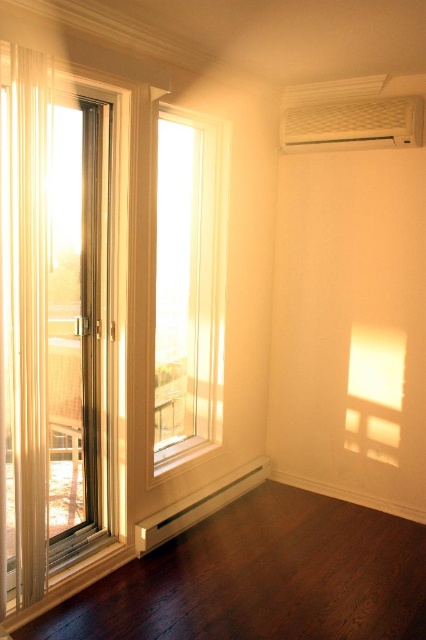
Question: Among these objects, which one is nearest to the camera?

Choices:
 (A) clear glass window at center
 (B) dark brown wood at lower left

Answer: (B)

Question: Considering the real-world distances, which object is farthest from the dark brown wood at lower left?

Choices:
 (A) clear glass window at center
 (B) white textured air conditioner at upper right
 (C) clear glass screen door at left
 (D) sheer white curtain at left

Answer: (B)

Question: Can you confirm if clear glass screen door at left is positioned above clear glass window at center?

Choices:
 (A) yes
 (B) no

Answer: (B)

Question: Can you confirm if clear glass window at center is positioned to the right of white textured air conditioner at upper right?

Choices:
 (A) no
 (B) yes

Answer: (A)

Question: Is clear glass screen door at left closer to the viewer compared to sheer white curtain at left?

Choices:
 (A) no
 (B) yes

Answer: (A)

Question: Which point is farther to the camera?

Choices:
 (A) dark brown wood at lower left
 (B) white textured air conditioner at upper right
 (C) clear glass window at center
 (D) sheer white curtain at left

Answer: (B)